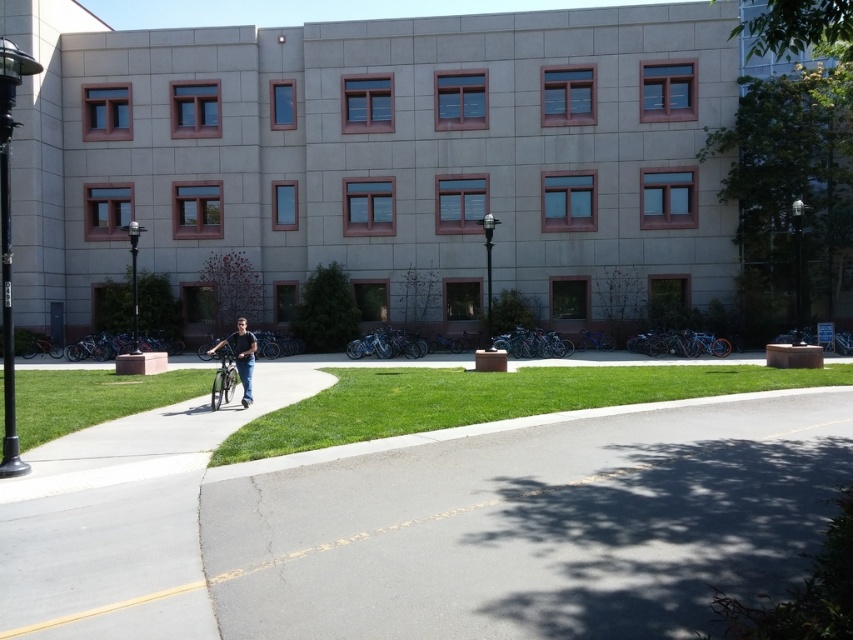
Is gray asphalt road at lower center closer to camera compared to jeans at center?

That is True.

Can you confirm if gray asphalt road at lower center is positioned to the left of jeans at center?

Incorrect, gray asphalt road at lower center is not on the left side of jeans at center.

Which is in front, point (718, 508) or point (254, 348)?

Point (718, 508) is more forward.

At what (x,y) coordinates should I click in order to perform the action: click on gray asphalt road at lower center. Please return your answer as a coordinate pair (x, y). This screenshot has width=853, height=640. Looking at the image, I should click on (531, 525).

Does gray asphalt road at lower center lie in front of green grass at center?

That is True.

Looking at this image, which is more to the right, gray asphalt road at lower center or green grass at center?

Positioned to the right is green grass at center.

This screenshot has width=853, height=640. What do you see at coordinates (531, 525) in the screenshot? I see `gray asphalt road at lower center` at bounding box center [531, 525].

You are a GUI agent. You are given a task and a screenshot of the screen. Output one action in this format:
    pyautogui.click(x=<x>, y=<y>)
    Task: Click on the gray asphalt road at lower center
    The width and height of the screenshot is (853, 640).
    Given the screenshot: What is the action you would take?
    pyautogui.click(x=531, y=525)

Is silver metallic bicycle at center thinner than jeans at center?

Correct, silver metallic bicycle at center's width is less than jeans at center's.

Measure the distance between silver metallic bicycle at center and jeans at center.

The distance of silver metallic bicycle at center from jeans at center is 29.13 inches.

This screenshot has width=853, height=640. In order to click on silver metallic bicycle at center in this screenshot , I will do pyautogui.click(x=223, y=378).

The image size is (853, 640). I want to click on silver metallic bicycle at center, so click(x=223, y=378).